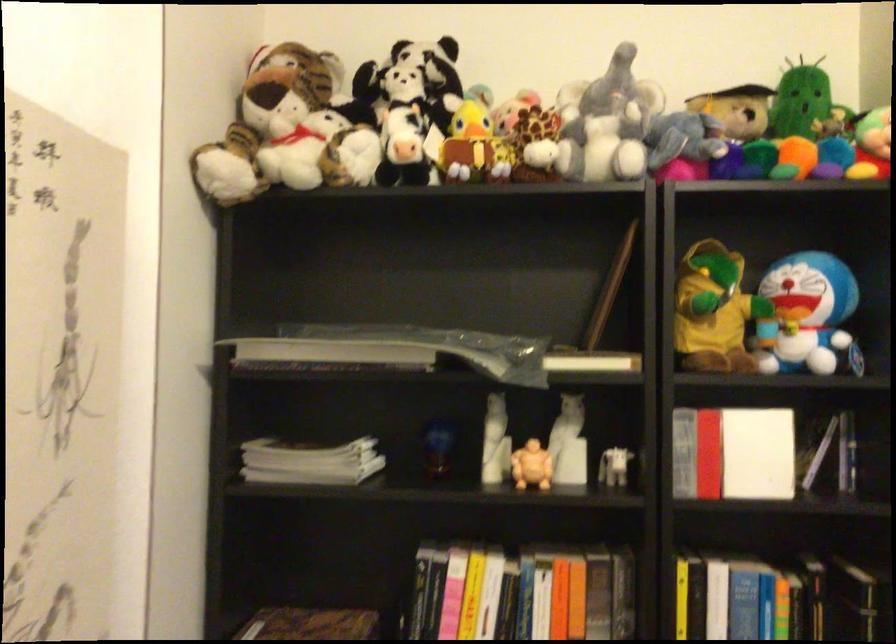
Where is `green stuffed toy`? The height and width of the screenshot is (644, 896). green stuffed toy is located at coordinates (799, 100).